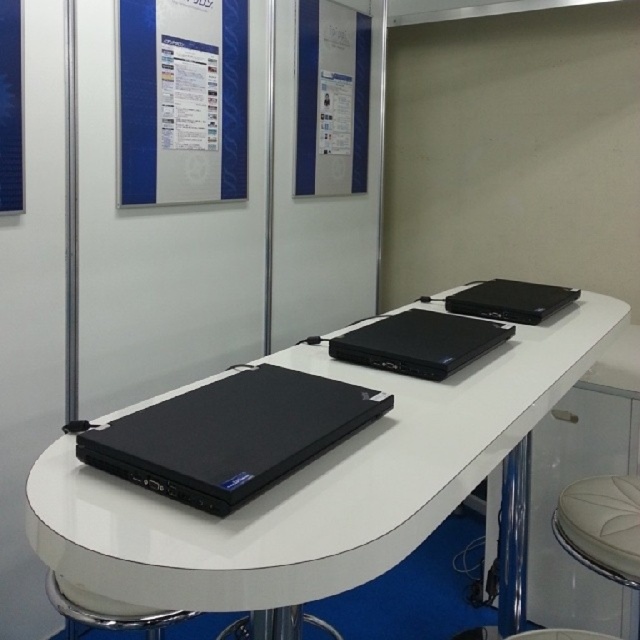
You are a photographer setting up a shot of the exhibition booth. You want to ensure that the blue glossy poster at upper left and the black matte laptop at upper right are both clearly visible in the frame. However, you notice that the poster is blocking part of the laptop. What adjustment can you make to your camera angle to capture both objects without obstruction?

Since the blue glossy poster at upper left is positioned over the black matte laptop at upper right, tilting the camera downward slightly would lower the angle, allowing the poster and laptop to be seen separately without overlap.

You are a photographer setting up for a product shoot. You have two black matte laptops to photograph. The black matte laptop at center and the black matte laptop at upper right. Which laptop should you choose to ensure the product image fills the frame adequately?

The black matte laptop at center is bigger than the black matte laptop at upper right, so choosing the black matte laptop at center will ensure the product image fills the frame adequately.